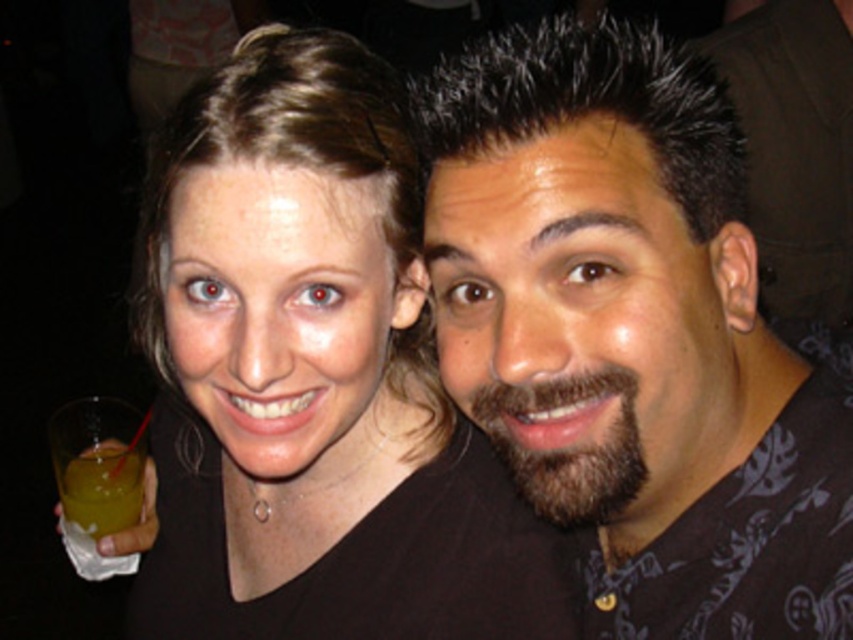
Question: Can you confirm if matte black shirt at center is positioned to the right of translucent yellow liquid at lower left?

Choices:
 (A) yes
 (B) no

Answer: (A)

Question: Which object is farther from the camera taking this photo?

Choices:
 (A) dark brown hair at center
 (B) translucent yellow liquid at lower left
 (C) matte black shirt at center

Answer: (B)

Question: Considering the real-world distances, which object is closest to the dark brown hair at center?

Choices:
 (A) matte black shirt at center
 (B) translucent yellow liquid at lower left

Answer: (A)

Question: Is dark brown hair at center smaller than translucent yellow liquid at lower left?

Choices:
 (A) no
 (B) yes

Answer: (A)

Question: Can you confirm if dark brown hair at center is positioned to the left of matte black shirt at center?

Choices:
 (A) yes
 (B) no

Answer: (B)

Question: Estimate the real-world distances between objects in this image. Which object is closer to the matte black shirt at center?

Choices:
 (A) dark brown hair at center
 (B) translucent yellow liquid at lower left

Answer: (A)